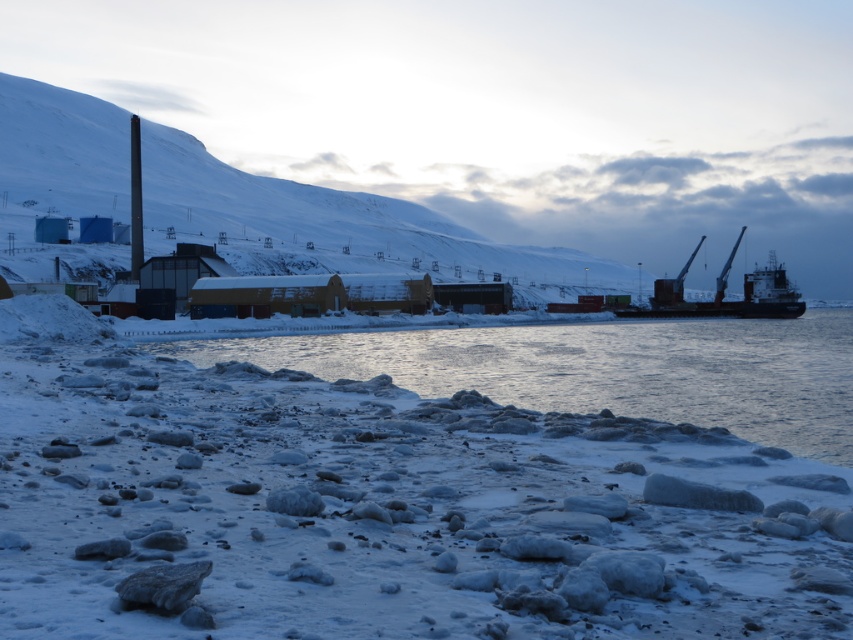
Looking at this image, does white frosty snow at lower left appear over clear ice water at lower center?

No.

Is the position of white frosty snow at lower left less distant than that of clear ice water at lower center?

Yes, white frosty snow at lower left is in front of clear ice water at lower center.

Who is more forward, (518, 477) or (845, 310)?

Point (518, 477) is more forward.

This screenshot has height=640, width=853. Identify the location of white frosty snow at lower left. (387, 513).

Can you confirm if clear ice water at lower center is positioned to the left of dark gray metallic ship at right?

Indeed, clear ice water at lower center is positioned on the left side of dark gray metallic ship at right.

Does clear ice water at lower center have a lesser width compared to dark gray metallic ship at right?

In fact, clear ice water at lower center might be wider than dark gray metallic ship at right.

Between point (746, 349) and point (680, 284), which one is positioned behind?

The point (680, 284) is behind.

Find the location of `clear ice water at lower center`. clear ice water at lower center is located at coordinates (606, 369).

Between white frosty snow at lower left and dark gray metallic ship at right, which one is positioned lower?

white frosty snow at lower left

Who is higher up, white frosty snow at lower left or dark gray metallic ship at right?

dark gray metallic ship at right is above.

This screenshot has height=640, width=853. In order to click on white frosty snow at lower left in this screenshot , I will do `click(387, 513)`.